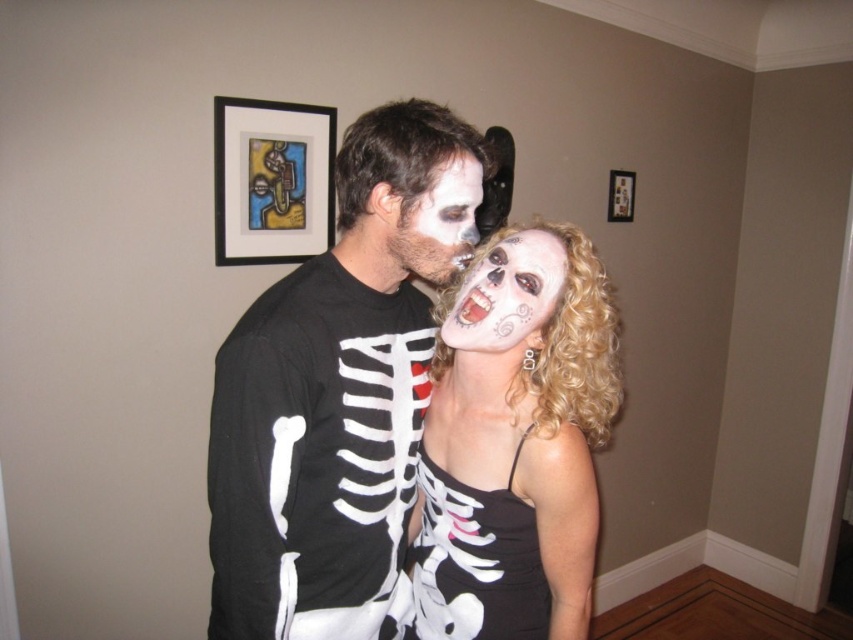
Does matte black t-shirt with skeleton design at center appear on the left side of black satin dress at center?

Indeed, matte black t-shirt with skeleton design at center is positioned on the left side of black satin dress at center.

Can you confirm if matte black t-shirt with skeleton design at center is wider than black satin dress at center?

Correct, the width of matte black t-shirt with skeleton design at center exceeds that of black satin dress at center.

This screenshot has height=640, width=853. Describe the element at coordinates (338, 392) in the screenshot. I see `matte black t-shirt with skeleton design at center` at that location.

I want to click on matte black t-shirt with skeleton design at center, so click(338, 392).

Based on the photo, is the position of black satin dress at center less distant than that of white matte skull at center?

No, black satin dress at center is further to the viewer.

Can you confirm if black satin dress at center is positioned to the right of white matte skull at center?

Yes, black satin dress at center is to the right of white matte skull at center.

Is point (451, 572) positioned behind point (433, 269)?

That is True.

Where is `black satin dress at center`? black satin dress at center is located at coordinates (474, 561).

Measure the distance from matte black t-shirt with skeleton design at center to wooden picture frame at upper center.

1.95 meters

Can you confirm if matte black t-shirt with skeleton design at center is shorter than wooden picture frame at upper center?

In fact, matte black t-shirt with skeleton design at center may be taller than wooden picture frame at upper center.

Is point (230, 433) behind point (630, 189)?

No.

Locate an element on the screen. matte black t-shirt with skeleton design at center is located at coordinates (338, 392).